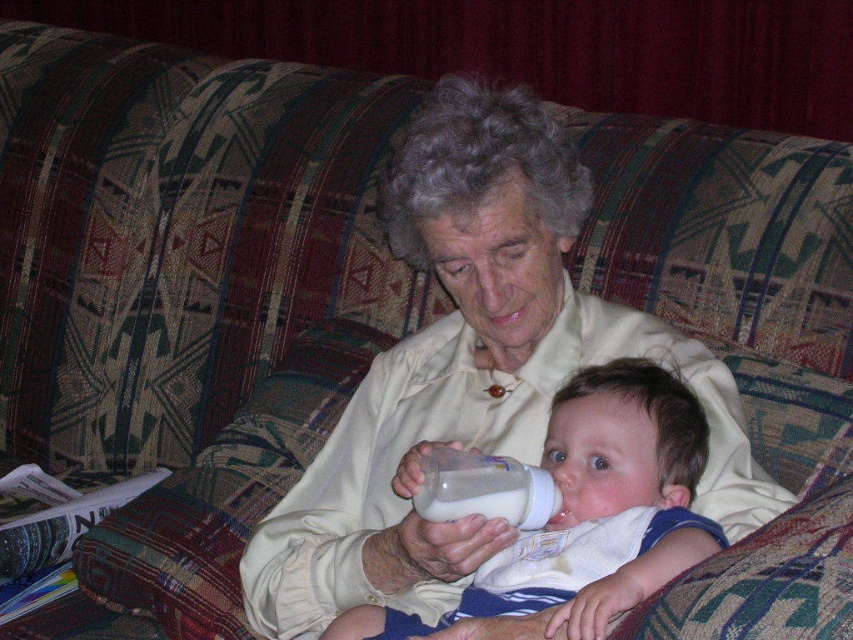
Question: Which point appears closest to the camera in this image?

Choices:
 (A) (438, 506)
 (B) (605, 378)

Answer: (A)

Question: Which point is closer to the camera?

Choices:
 (A) white plastic baby bottle at center
 (B) white cotton bib at center

Answer: (B)

Question: Considering the relative positions of white cotton bib at center and white plastic baby bottle at center in the image provided, where is white cotton bib at center located with respect to white plastic baby bottle at center?

Choices:
 (A) above
 (B) below

Answer: (B)

Question: Which point is closer to the camera?

Choices:
 (A) [505, 490]
 (B) [502, 554]

Answer: (A)

Question: Does white cotton bib at center appear on the left side of white plastic baby bottle at center?

Choices:
 (A) yes
 (B) no

Answer: (B)

Question: Can you confirm if white cotton bib at center is smaller than white plastic baby bottle at center?

Choices:
 (A) yes
 (B) no

Answer: (B)